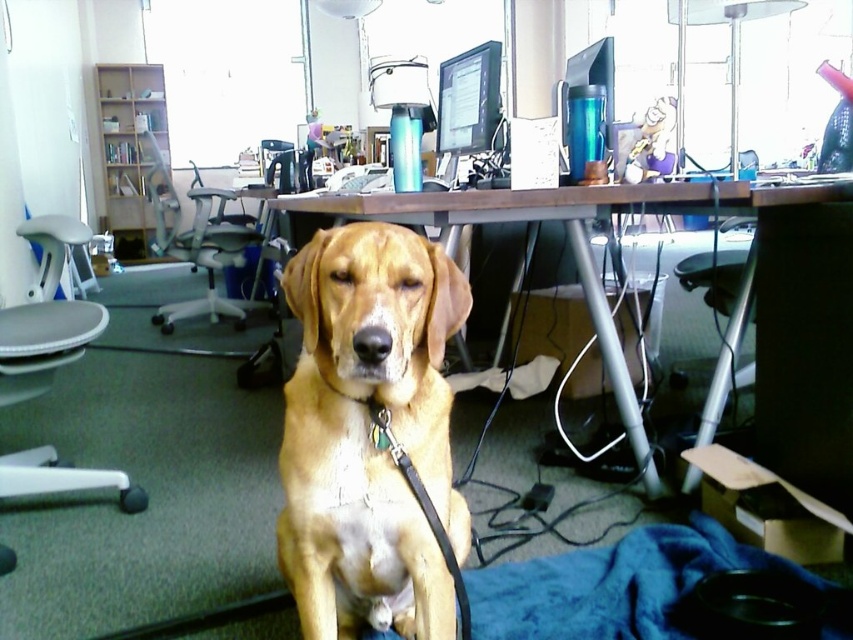
Question: Which point is farther to the camera?

Choices:
 (A) (222, 193)
 (B) (785, 346)

Answer: (A)

Question: Which point is closer to the camera taking this photo?

Choices:
 (A) (410, 632)
 (B) (827, 250)
 (C) (495, 118)
 (D) (158, 204)

Answer: (A)

Question: Is golden fur dog at center above brown wooden desk at center?

Choices:
 (A) yes
 (B) no

Answer: (B)

Question: Considering the real-world distances, which object is closest to the brown wooden desk at center?

Choices:
 (A) white plastic office chair at left
 (B) matte black monitor at upper center

Answer: (B)

Question: Is golden fur dog at center bigger than white plastic office chair at left?

Choices:
 (A) no
 (B) yes

Answer: (A)

Question: Does white plastic office chair at left lie in front of matte black monitor at upper center?

Choices:
 (A) yes
 (B) no

Answer: (B)